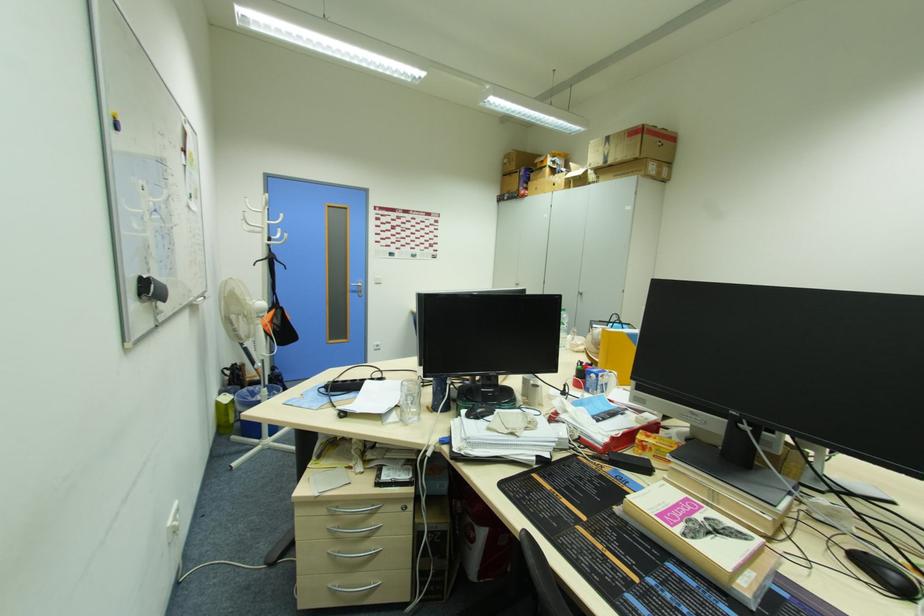
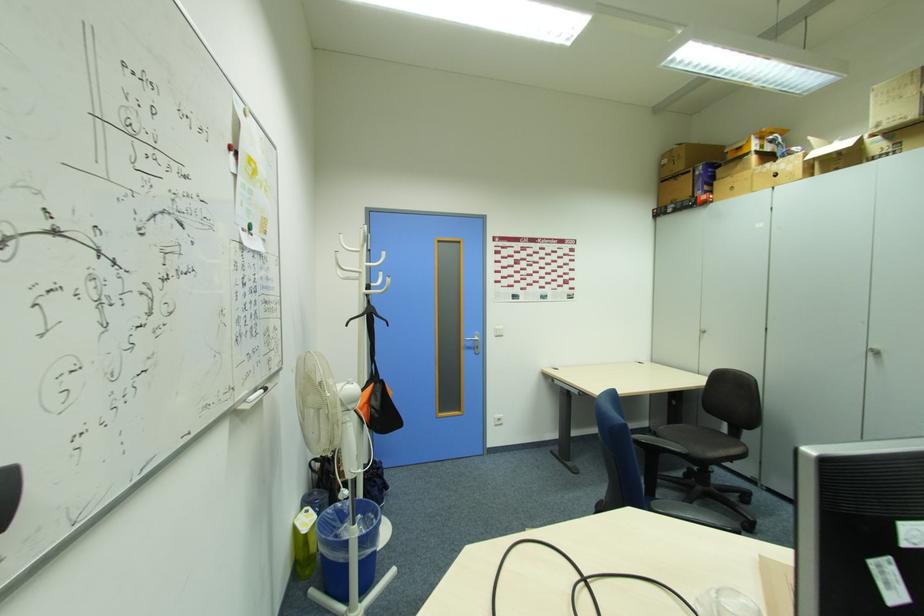
The point at (556, 185) is marked in the first image. Where is the corresponding point in the second image?

(779, 176)